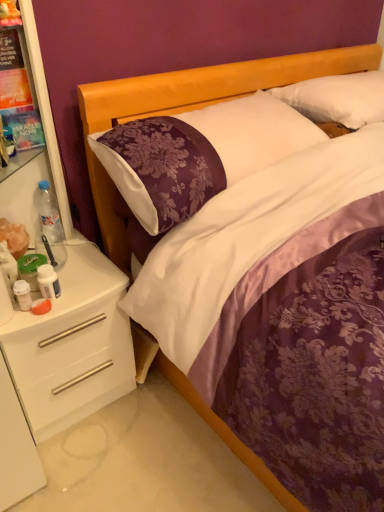
Question: Considering the relative positions of purple satin bed at center and white glossy drawer at lower left in the image provided, is purple satin bed at center to the right of white glossy drawer at lower left from the viewer's perspective?

Choices:
 (A) yes
 (B) no

Answer: (A)

Question: Can you confirm if purple satin bed at center is taller than white glossy drawer at lower left?

Choices:
 (A) no
 (B) yes

Answer: (B)

Question: Can white glossy drawer at lower left be found inside purple satin bed at center?

Choices:
 (A) yes
 (B) no

Answer: (B)

Question: Is purple satin bed at center closer to camera compared to white glossy drawer at lower left?

Choices:
 (A) no
 (B) yes

Answer: (B)

Question: Does purple satin bed at center have a smaller size compared to white glossy drawer at lower left?

Choices:
 (A) yes
 (B) no

Answer: (B)

Question: Is white soft pillow at upper right, marked as the 2th pillow in a left-to-right arrangement, wider or thinner than white plastic shelf at left?

Choices:
 (A) wide
 (B) thin

Answer: (A)

Question: Would you say white soft pillow at upper right, which is the 1th pillow from right to left, is to the left or to the right of white plastic shelf at left in the picture?

Choices:
 (A) right
 (B) left

Answer: (A)

Question: From a real-world perspective, is white soft pillow at upper right, marked as the 2th pillow in a left-to-right arrangement, positioned above or below white plastic shelf at left?

Choices:
 (A) above
 (B) below

Answer: (B)

Question: From the image's perspective, is white soft pillow at upper right, marked as the 2th pillow in a left-to-right arrangement, located above or below white plastic shelf at left?

Choices:
 (A) above
 (B) below

Answer: (A)

Question: Do you think white plastic bottle at left, the 2th bottle in the front-to-back sequence, is within white plastic shelf at left, or outside of it?

Choices:
 (A) outside
 (B) inside

Answer: (B)

Question: Is white plastic bottle at left, which is counted as the second bottle, starting from the bottom, bigger or smaller than white plastic shelf at left?

Choices:
 (A) big
 (B) small

Answer: (B)

Question: Considering their positions, is white plastic bottle at left, the 2th bottle in the front-to-back sequence, located in front of or behind white plastic shelf at left?

Choices:
 (A) behind
 (B) front

Answer: (A)

Question: Does point (44, 285) appear closer or farther from the camera than point (89, 257)?

Choices:
 (A) farther
 (B) closer

Answer: (B)

Question: Is white glossy drawer at lower left bigger or smaller than purple satin pillow at center, the 1th pillow viewed from the left?

Choices:
 (A) big
 (B) small

Answer: (A)

Question: Considering the positions of point (104, 306) and point (182, 182), is point (104, 306) closer or farther from the camera than point (182, 182)?

Choices:
 (A) farther
 (B) closer

Answer: (A)